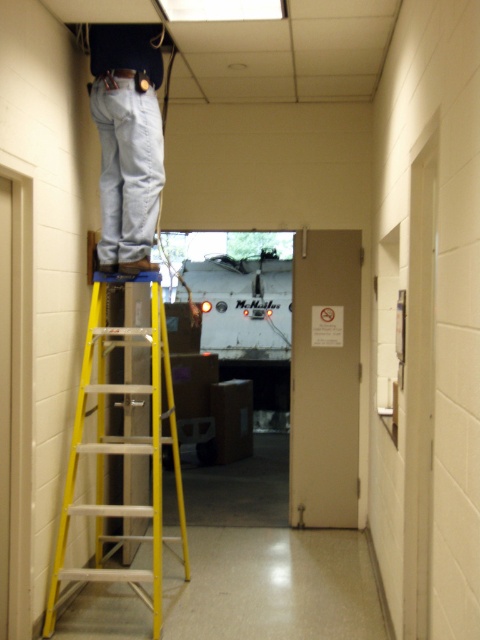
Question: Does yellow aluminum ladder at center appear over denim pants at upper center?

Choices:
 (A) no
 (B) yes

Answer: (A)

Question: Among these points, which one is farthest from the camera?

Choices:
 (A) (120, 259)
 (B) (153, 508)

Answer: (A)

Question: Can you confirm if yellow aluminum ladder at center is thinner than denim pants at upper center?

Choices:
 (A) yes
 (B) no

Answer: (B)

Question: Which point is closer to the camera?

Choices:
 (A) yellow aluminum ladder at center
 (B) denim pants at upper center

Answer: (A)

Question: Can you confirm if yellow aluminum ladder at center is bigger than denim pants at upper center?

Choices:
 (A) yes
 (B) no

Answer: (A)